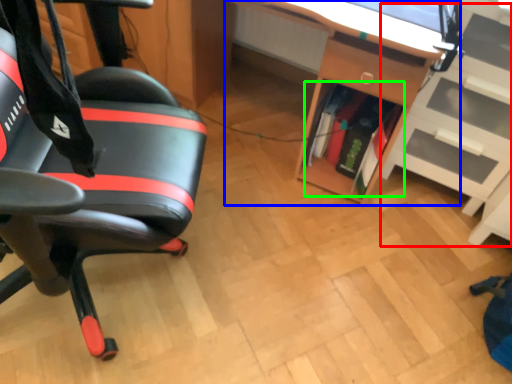
Question: Considering the real-world distances, which object is closest to shelf (highlighted by a red box)? desk (highlighted by a blue box) or book (highlighted by a green box).

Choices:
 (A) desk
 (B) book

Answer: (B)